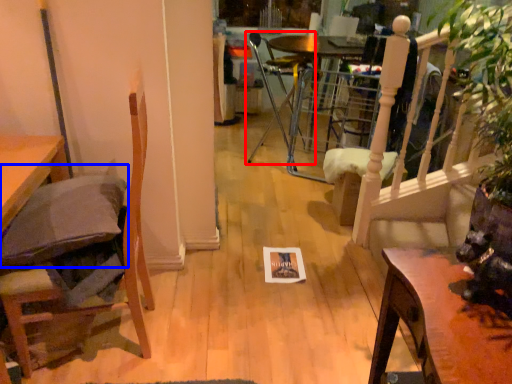
Question: Among these objects, which one is farthest to the camera, chair (highlighted by a red box) or pillow (highlighted by a blue box)?

Choices:
 (A) chair
 (B) pillow

Answer: (A)